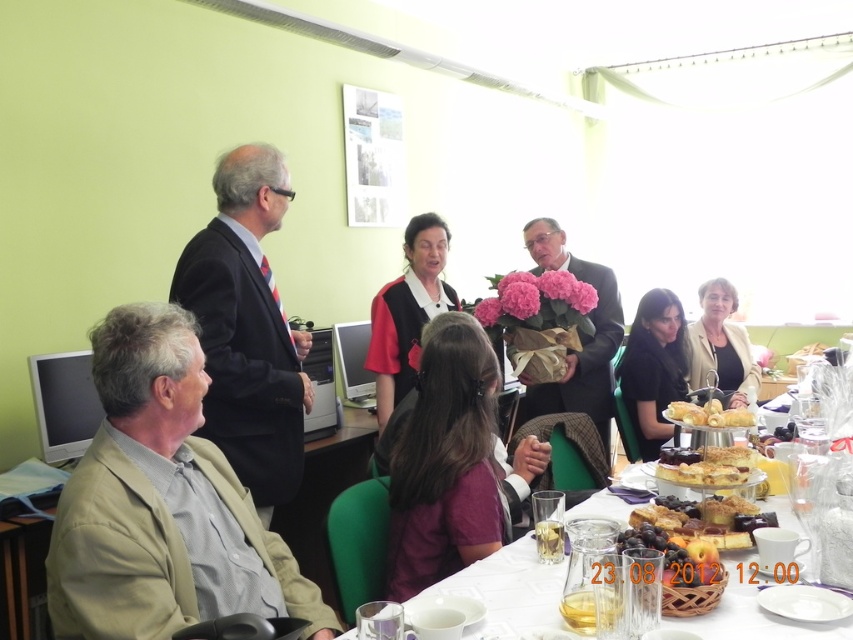
Between dark suit at center and shiny glass grapes at lower center, which one is positioned higher?

dark suit at center

Does dark suit at center appear under shiny glass grapes at lower center?

No.

Who is more forward, (253,493) or (711,561)?

Positioned in front is point (711,561).

You are a GUI agent. You are given a task and a screenshot of the screen. Output one action in this format:
    pyautogui.click(x=<x>, y=<y>)
    Task: Click on the dark suit at center
    
    Given the screenshot: What is the action you would take?
    pyautogui.click(x=247, y=328)

Consider the image. Who is taller, dark suit at center or purple fabric shirt at center?

dark suit at center is taller.

Who is positioned more to the left, dark suit at center or purple fabric shirt at center?

Positioned to the left is dark suit at center.

Does point (206, 436) come in front of point (444, 429)?

No.

You are a GUI agent. You are given a task and a screenshot of the screen. Output one action in this format:
    pyautogui.click(x=<x>, y=<y>)
    Task: Click on the dark suit at center
    The image size is (853, 640).
    Given the screenshot: What is the action you would take?
    [247, 328]

Does purple fabric shirt at center appear under red fabric dress at center?

Indeed, purple fabric shirt at center is positioned under red fabric dress at center.

Can you confirm if purple fabric shirt at center is positioned to the left of red fabric dress at center?

In fact, purple fabric shirt at center is to the right of red fabric dress at center.

The image size is (853, 640). What do you see at coordinates (447, 461) in the screenshot? I see `purple fabric shirt at center` at bounding box center [447, 461].

The height and width of the screenshot is (640, 853). In order to click on purple fabric shirt at center in this screenshot , I will do `click(447, 461)`.